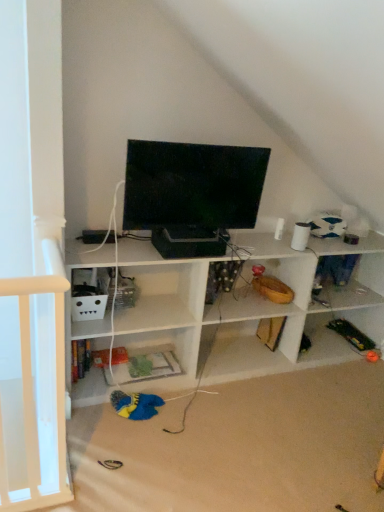
Measure the distance between point (147, 168) and camera.

They are 6.54 feet apart.

What do you see at coordinates (192, 185) in the screenshot? I see `matte black tv at center` at bounding box center [192, 185].

Find the location of a particular element. Image resolution: width=384 pixels, height=512 pixels. matte black tv at center is located at coordinates pyautogui.click(x=192, y=185).

Measure the distance between matte black tv at center and camera.

A distance of 6.37 feet exists between matte black tv at center and camera.

Find the location of a particular element. matte black tv at center is located at coordinates (192, 185).